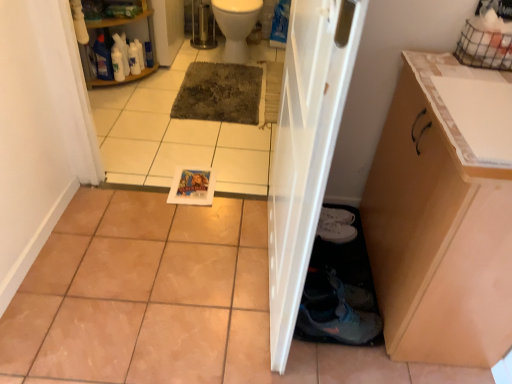
Locate an element on the screen. The width and height of the screenshot is (512, 384). free space in front of white glossy door at center is located at coordinates (250, 345).